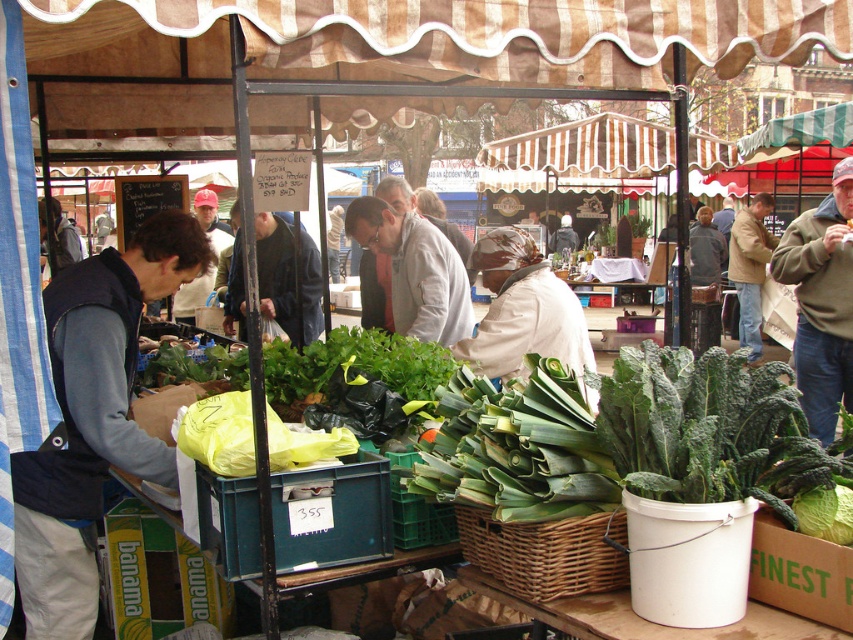
Question: Is woven brown basket at lower center positioned before tan leather jacket at upper right?

Choices:
 (A) yes
 (B) no

Answer: (A)

Question: Which point is farther to the camera?

Choices:
 (A) (403, 502)
 (B) (90, 285)

Answer: (B)

Question: Does green leafy at center have a larger size compared to dark blue jacket at center?

Choices:
 (A) yes
 (B) no

Answer: (B)

Question: Which of these objects is positioned closest to the dark blue jacket at center?

Choices:
 (A) green leafy at center
 (B) green fuzzy sweater at right

Answer: (A)

Question: Among these points, which one is nearest to the camera?

Choices:
 (A) (419, 456)
 (B) (442, 308)

Answer: (A)

Question: Does green fuzzy sweater at right appear under tan leather jacket at upper right?

Choices:
 (A) no
 (B) yes

Answer: (B)